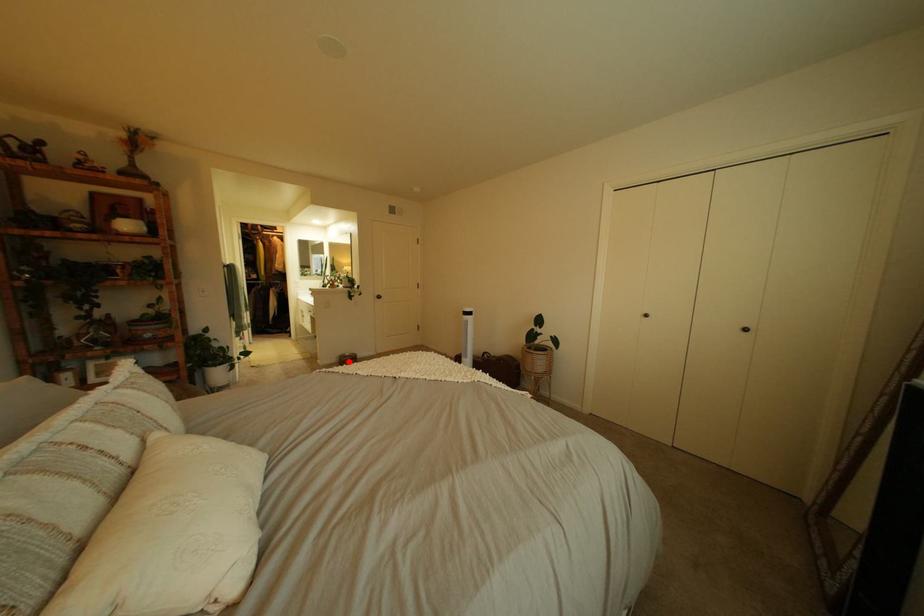
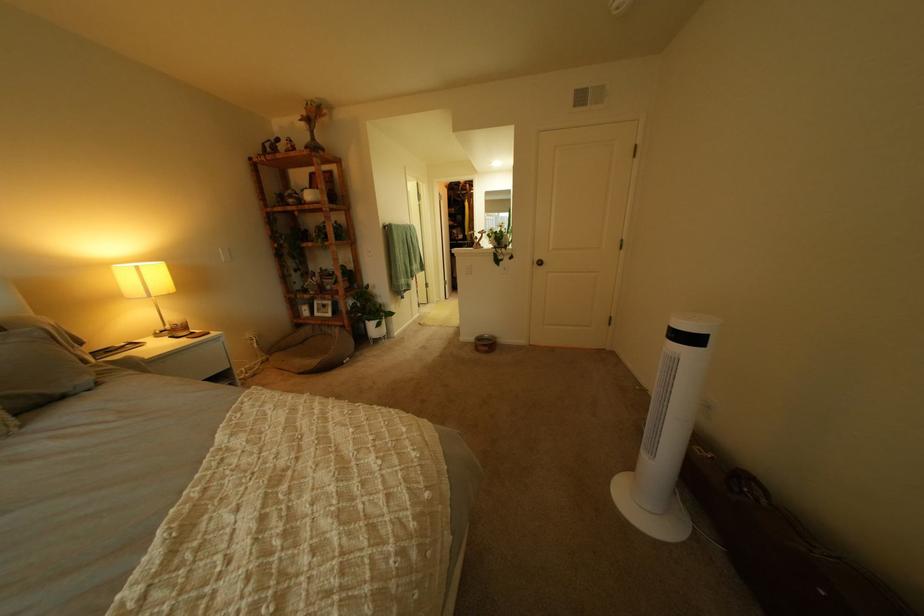
Question: I am providing you with two images of the same scene from different viewpoints. Given a red point in image1, look at the same physical point in image2. Is it:

Choices:
 (A) Closer to the viewpoint
 (B) Farther from the viewpoint

Answer: (B)